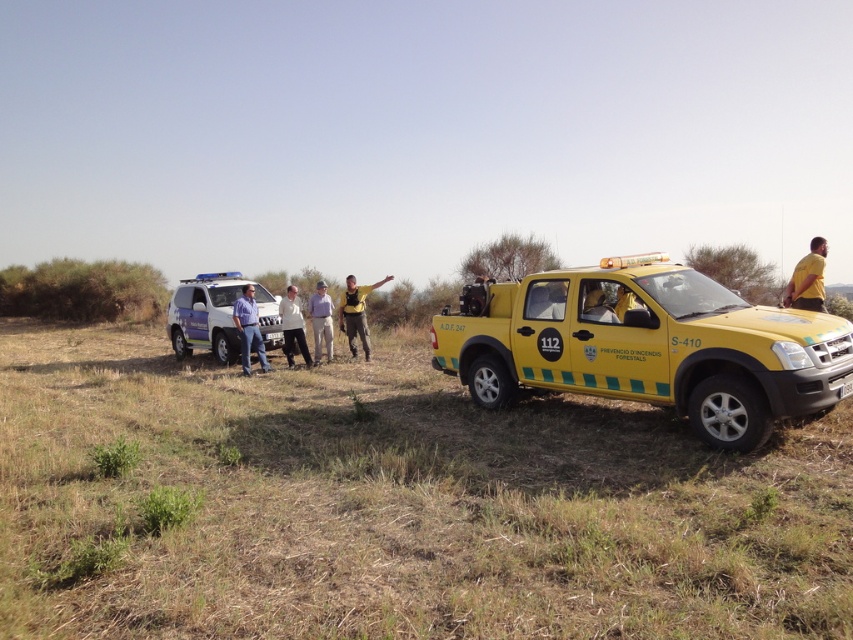
Looking at this image, you are a photographer trying to capture a group photo of the people wearing the blue shirt at center and the light brown leather jacket at center. Which clothing item should you focus on first to ensure it fits entirely within the frame if your camera has a fixed width?

The blue shirt at center has a greater width than the light brown leather jacket at center. Therefore, you should focus on the blue shirt at center first to ensure it fits entirely within the frame since it is wider.

You are a drone operator tasked with capturing aerial footage of the brown grassy dirt field at lower center. The field is located at coordinates point 0.791, 0.465. Your drone has a maximum flight range of 100 meters. If you are currently positioned at the origin point, can your drone reach the field?

The brown grassy dirt field at lower center is located at coordinates point (396, 506). Since the drone has a maximum flight range of 100 meters, it can easily reach the field as the distance from the origin point would be within the 100 meters range.